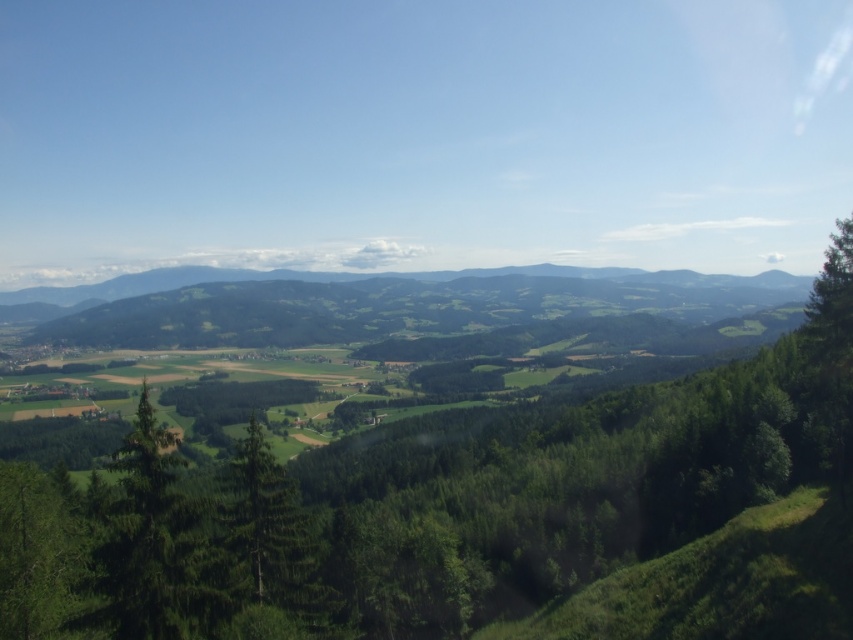
Question: Is green leafy tree at center to the right of green matte tree at center from the viewer's perspective?

Choices:
 (A) yes
 (B) no

Answer: (A)

Question: Which of the following is the closest to the observer?

Choices:
 (A) (289, 598)
 (B) (753, 397)

Answer: (A)

Question: Among these points, which one is farthest from the camera?

Choices:
 (A) (498, 596)
 (B) (311, 602)

Answer: (A)

Question: Does green leafy tree at center appear on the left side of green matte tree at center?

Choices:
 (A) no
 (B) yes

Answer: (A)

Question: Does green leafy tree at center have a smaller size compared to green matte tree at center?

Choices:
 (A) no
 (B) yes

Answer: (A)